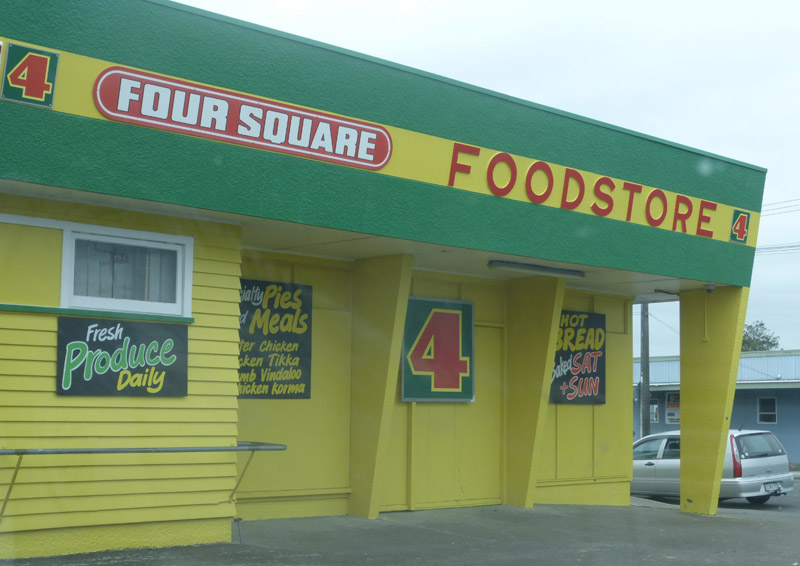
At what (x,y) coordinates should I click in order to perform the action: click on white under panelling. Please return your answer as a coordinate pair (x, y). This screenshot has width=800, height=566. Looking at the image, I should click on (281, 233).